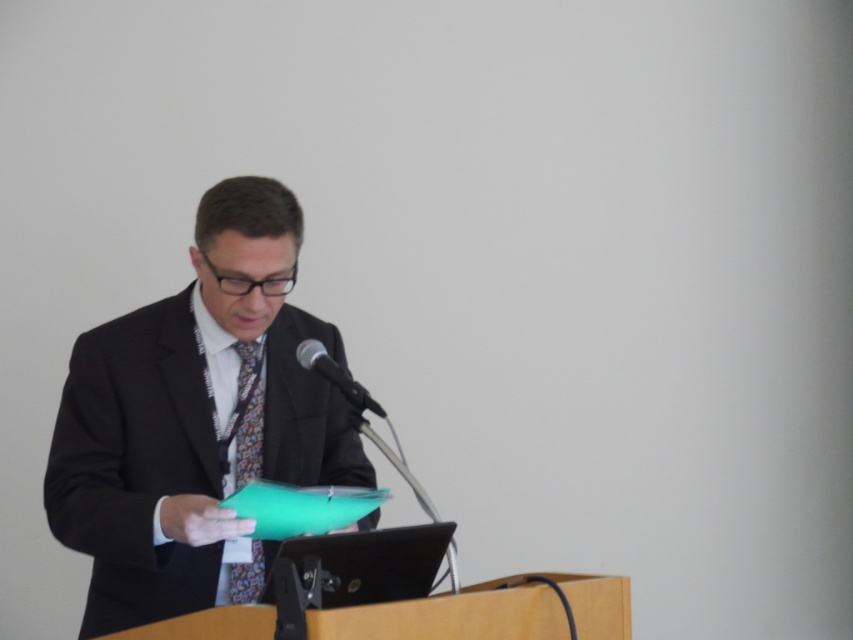
Question: Can you confirm if matte black suit at center is positioned above floral silk tie at center?

Choices:
 (A) yes
 (B) no

Answer: (A)

Question: Can you confirm if floral silk tie at center is positioned to the left of black metallic microphone at center?

Choices:
 (A) yes
 (B) no

Answer: (A)

Question: Which point is closer to the camera taking this photo?

Choices:
 (A) (123, 364)
 (B) (254, 442)

Answer: (A)

Question: Does matte black suit at center have a greater width compared to black metallic microphone at center?

Choices:
 (A) no
 (B) yes

Answer: (B)

Question: Which point is farther from the camera taking this photo?

Choices:
 (A) (363, 394)
 (B) (199, 356)

Answer: (B)

Question: Which object is the closest to the matte black suit at center?

Choices:
 (A) black metallic microphone at center
 (B) floral silk tie at center

Answer: (B)